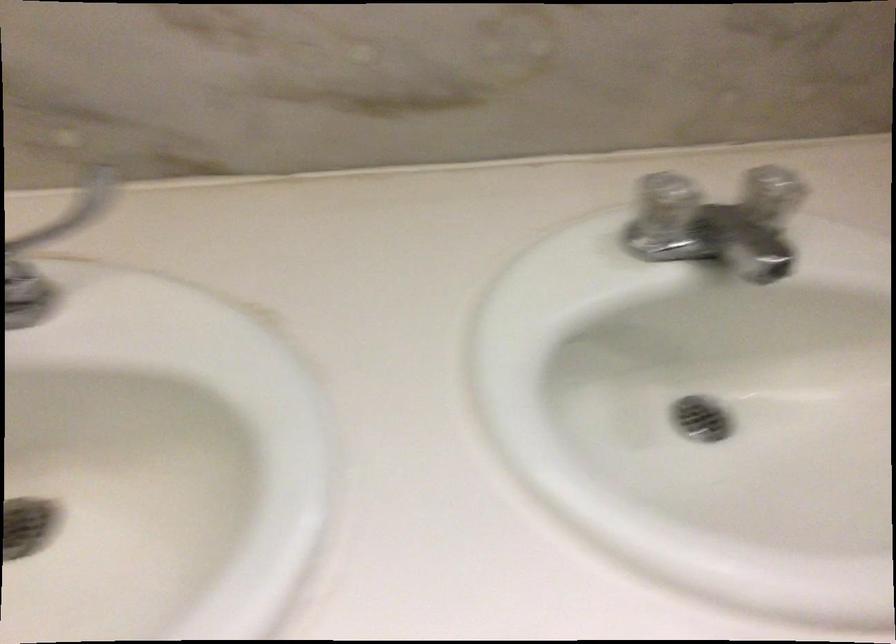
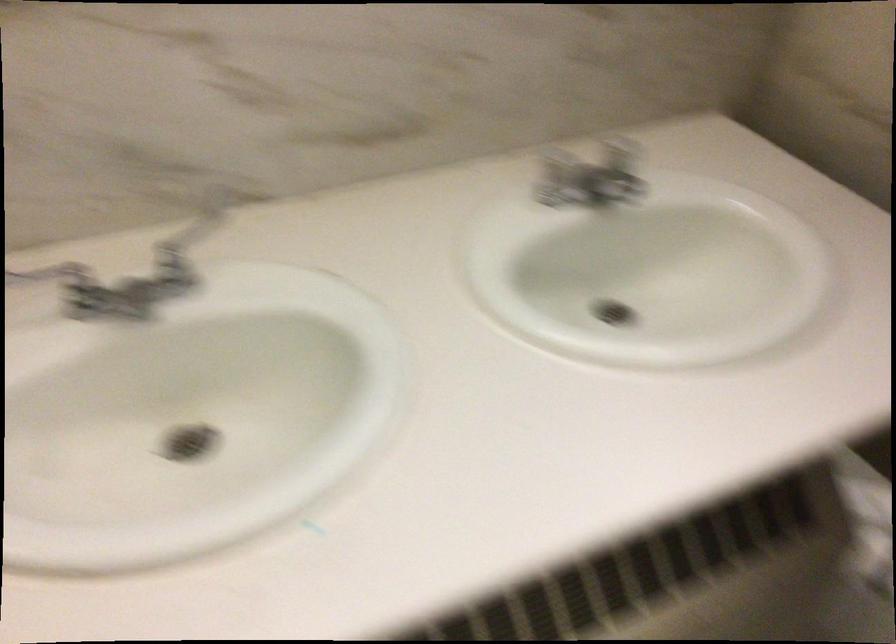
In the second image, find the point that corresponds to (778,189) in the first image.

(622, 147)